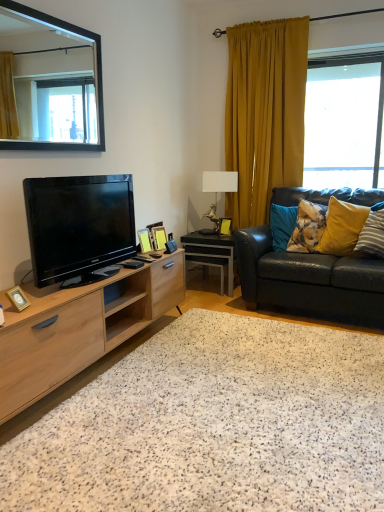
Locate an element on the screen. This screenshot has height=512, width=384. metallic gold lamp at center is located at coordinates (220, 181).

The image size is (384, 512). I want to click on white speckled carpet at center, so coord(214,425).

What is the approximate width of natural wood cabinet at left?

natural wood cabinet at left is 17.36 inches in width.

This screenshot has height=512, width=384. What are the coordinates of `black glossy side table at center` in the screenshot? It's located at (211, 252).

Does wooden picture frame at center, the 4th picture frame in the bottom-to-top sequence, have a lesser height compared to natural wood cabinet at left?

Correct, wooden picture frame at center, the 4th picture frame in the bottom-to-top sequence, is not as tall as natural wood cabinet at left.

Considering the positions of objects wooden picture frame at center, the first picture frame in the back-to-front sequence, and natural wood cabinet at left in the image provided, who is in front, wooden picture frame at center, the first picture frame in the back-to-front sequence, or natural wood cabinet at left?

natural wood cabinet at left is in front.

Considering the relative sizes of wooden picture frame at center, marked as the first picture frame in a top-to-bottom arrangement, and natural wood cabinet at left in the image provided, is wooden picture frame at center, marked as the first picture frame in a top-to-bottom arrangement, wider than natural wood cabinet at left?

Incorrect, the width of wooden picture frame at center, marked as the first picture frame in a top-to-bottom arrangement, does not surpass that of natural wood cabinet at left.

Who is smaller, wooden picture frame at center, marked as the first picture frame in a top-to-bottom arrangement, or natural wood cabinet at left?

wooden picture frame at center, marked as the first picture frame in a top-to-bottom arrangement.

Is point (254, 245) closer or farther from the camera than point (166, 239)?

Clearly, point (254, 245) is more distant from the camera than point (166, 239).

Between leather couch at right and wooden picture frame at center, arranged as the second picture frame when viewed from the right, which one has more height?

Standing taller between the two is leather couch at right.

Is mustard yellow fabric curtain at right turned away from wooden picture frame at center, the first picture frame in the back-to-front sequence?

Yes, mustard yellow fabric curtain at right is positioned with its back facing wooden picture frame at center, the first picture frame in the back-to-front sequence.

Considering the points (282, 183) and (222, 222), which point is behind, point (282, 183) or point (222, 222)?

The point (282, 183) is farther.

From the mustard yellow fabric curtain at right, count the 1st picture frame to the left and point to it. Please provide its 2D coordinates.

[(225, 226)]

Looking at their sizes, would you say mustard yellow fabric curtain at right is wider or thinner than wooden picture frame at center, the 4th picture frame in the bottom-to-top sequence?

Clearly, mustard yellow fabric curtain at right has more width compared to wooden picture frame at center, the 4th picture frame in the bottom-to-top sequence.

Is transparent glass window at upper right situated inside gold metallic photo frame at lower left, acting as the 1th picture frame starting from the front, or outside?

transparent glass window at upper right lies outside gold metallic photo frame at lower left, acting as the 1th picture frame starting from the front.

Considering the sizes of objects transparent glass window at upper right and gold metallic photo frame at lower left, the first picture frame when ordered from left to right, in the image provided, who is smaller, transparent glass window at upper right or gold metallic photo frame at lower left, the first picture frame when ordered from left to right,?

gold metallic photo frame at lower left, the first picture frame when ordered from left to right.

Which of these two, transparent glass window at upper right or gold metallic photo frame at lower left, the 4th picture frame when ordered from right to left, stands shorter?

gold metallic photo frame at lower left, the 4th picture frame when ordered from right to left, is shorter.

Between transparent glass window at upper right and gold metallic photo frame at lower left, which is the fourth picture frame in top-to-bottom order, which one appears on the left side from the viewer's perspective?

gold metallic photo frame at lower left, which is the fourth picture frame in top-to-bottom order.

Is metallic gold lamp at center outside of fluffy blue pillow at right, which ranks as the third pillow in right-to-left order?

Yes, metallic gold lamp at center is not within fluffy blue pillow at right, which ranks as the third pillow in right-to-left order.

Is point (226, 170) closer or farther from the camera than point (293, 245)?

Point (226, 170) appears to be farther away from the viewer than point (293, 245).

At what (x,y) coordinates should I click in order to perform the action: click on the 1st pillow below the metallic gold lamp at center (from the image's perspective). Please return your answer as a coordinate pair (x, y). This screenshot has width=384, height=512. Looking at the image, I should click on (308, 227).

Is metallic gold lamp at center further to camera compared to fluffy blue pillow at right, which is the 1th pillow from left to right?

Yes, metallic gold lamp at center is behind fluffy blue pillow at right, which is the 1th pillow from left to right.

From a real-world perspective, is wooden picture frame at center, which is the second picture frame in back-to-front order, on black plastic remote control at lower left, placed as the second remote control when sorted from back to front?

Indeed, from a real-world perspective, wooden picture frame at center, which is the second picture frame in back-to-front order, stands above black plastic remote control at lower left, placed as the second remote control when sorted from back to front.

Considering the relative positions of wooden picture frame at center, arranged as the 2th picture frame when viewed from the top, and black plastic remote control at lower left, the 1th remote control viewed from the front, in the image provided, is wooden picture frame at center, arranged as the 2th picture frame when viewed from the top, behind black plastic remote control at lower left, the 1th remote control viewed from the front,?

That is True.

Which object is positioned more to the left, wooden picture frame at center, the third picture frame ordered from the bottom, or black plastic remote control at lower left, the 1th remote control viewed from the front?

black plastic remote control at lower left, the 1th remote control viewed from the front, is more to the left.

Which is further, [164,229] or [123,263]?

The point [164,229] is more distant.

From a real-world perspective, does fluffy blue pillow at right, which is the 1th pillow from left to right, sit lower than yellow fabric pillow at right, which is the third pillow from left to right?

Indeed, from a real-world perspective, fluffy blue pillow at right, which is the 1th pillow from left to right, is positioned beneath yellow fabric pillow at right, which is the third pillow from left to right.

Between fluffy blue pillow at right, which is the 1th pillow from left to right, and yellow fabric pillow at right, which is the third pillow from left to right, which one has larger size?

fluffy blue pillow at right, which is the 1th pillow from left to right, is bigger.

From their relative heights in the image, would you say fluffy blue pillow at right, which ranks as the third pillow in right-to-left order, is taller or shorter than yellow fabric pillow at right, which is the third pillow from left to right?

In the image, fluffy blue pillow at right, which ranks as the third pillow in right-to-left order, appears to be shorter than yellow fabric pillow at right, which is the third pillow from left to right.

Which object is positioned more to the right, fluffy blue pillow at right, which is the 1th pillow from left to right, or yellow fabric pillow at right, which is the third pillow from left to right?

From the viewer's perspective, yellow fabric pillow at right, which is the third pillow from left to right, appears more on the right side.

In order to click on the 3rd picture frame counting from the right of the natural wood cabinet at left in this screenshot , I will do `click(225, 226)`.

Locate an element on the screen. The width and height of the screenshot is (384, 512). the 2nd picture frame behind the leather couch at right is located at coordinates (159, 237).

Considering their positions, is transparent glass window at upper right positioned closer to fluffy blue pillow at right, which ranks as the third pillow in right-to-left order, than velvet yellow pillow at right, the 2th pillow from the right?

The object closer to fluffy blue pillow at right, which ranks as the third pillow in right-to-left order, is velvet yellow pillow at right, the 2th pillow from the right.

Based on their spatial positions, is transparent glass window at upper right or metallic gold lamp at center further from wooden picture frame at center, the 2th picture frame positioned from the bottom?

transparent glass window at upper right.

Considering their positions, is natural wood cabinet at left positioned closer to black plastic remote control at lower left, the 1th remote control viewed from the back, than metallic gold lamp at center?

The object closer to black plastic remote control at lower left, the 1th remote control viewed from the back, is natural wood cabinet at left.

When comparing their distances from yellow fabric pillow at right, which is the third pillow from left to right, does natural wood cabinet at left or black plastic remote control at lower left, the 1th remote control viewed from the back, seem closer?

black plastic remote control at lower left, the 1th remote control viewed from the back, is positioned closer to the anchor yellow fabric pillow at right, which is the third pillow from left to right.

Considering their positions, is black glossy side table at center positioned further to natural wood cabinet at left than gold metallic photo frame at lower left, which is the fourth picture frame in top-to-bottom order?

Among the two, black glossy side table at center is located further to natural wood cabinet at left.

Which object lies nearer to the anchor point velvet yellow pillow at right, arranged as the 2th pillow when viewed from the left, wooden picture frame at center, the 4th picture frame in the bottom-to-top sequence, or fluffy blue pillow at right, which is the 1th pillow from left to right?

fluffy blue pillow at right, which is the 1th pillow from left to right, lies closer to velvet yellow pillow at right, arranged as the 2th pillow when viewed from the left, than the other object.

Looking at the image, which one is located closer to gold metallic photo frame at lower left, acting as the 1th picture frame starting from the front, leather couch at right or mustard yellow fabric curtain at right?

leather couch at right is positioned closer to the anchor gold metallic photo frame at lower left, acting as the 1th picture frame starting from the front.

Estimate the real-world distances between objects in this image. Which object is closer to velvet yellow pillow at right, arranged as the 2th pillow when viewed from the left, black glossy tv at left or wooden picture frame at center, the 2th picture frame positioned from the bottom?

wooden picture frame at center, the 2th picture frame positioned from the bottom, lies closer to velvet yellow pillow at right, arranged as the 2th pillow when viewed from the left, than the other object.

This screenshot has height=512, width=384. Find the location of `curtain located between black plastic remote control at lower left, placed as the second remote control when sorted from back to front, and black glossy side table at center in the depth direction`. curtain located between black plastic remote control at lower left, placed as the second remote control when sorted from back to front, and black glossy side table at center in the depth direction is located at coordinates point(264,113).

At what (x,y) coordinates should I click in order to perform the action: click on lamp situated between black framed mirror at upper left and transparent glass window at upper right from left to right. Please return your answer as a coordinate pair (x, y). This screenshot has height=512, width=384. Looking at the image, I should click on (220, 181).

You are a GUI agent. You are given a task and a screenshot of the screen. Output one action in this format:
    pyautogui.click(x=<x>, y=<y>)
    Task: Click on the studio couch located between white speckled carpet at center and wooden picture frame at center, which is the 3th picture frame from front to back, in the depth direction
    
    Given the screenshot: What is the action you would take?
    pyautogui.click(x=309, y=280)

Where is `lamp between black framed mirror at upper left and wooden picture frame at center, which is the first picture frame in right-to-left order, along the z-axis`? The image size is (384, 512). lamp between black framed mirror at upper left and wooden picture frame at center, which is the first picture frame in right-to-left order, along the z-axis is located at coordinates pos(220,181).